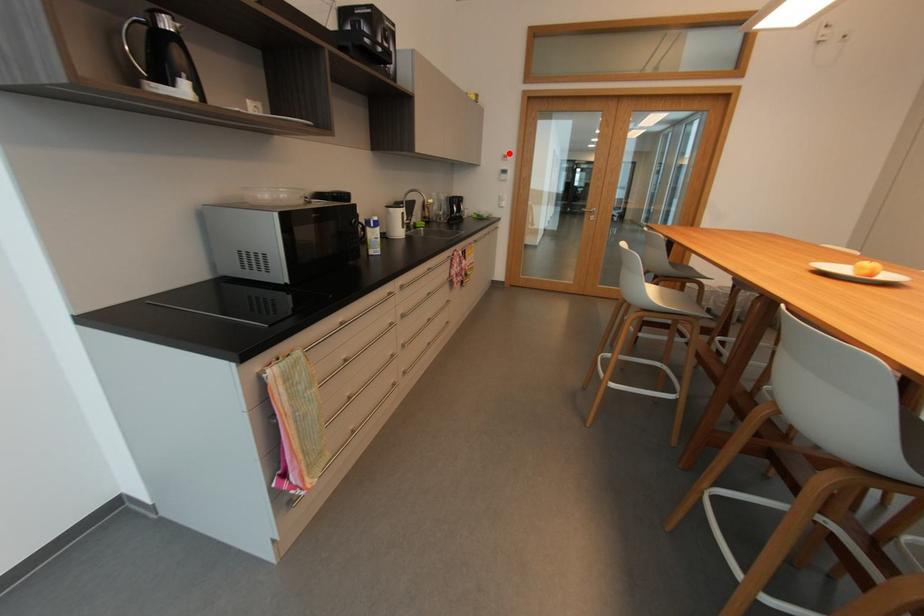
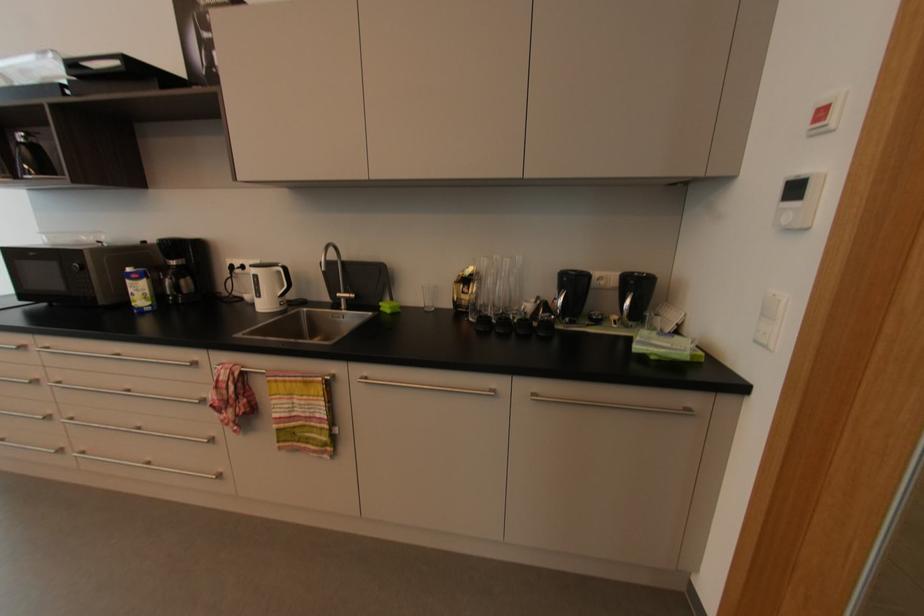
Where in the second image is the point corresponding to the highlighted location from the first image?

(832, 99)